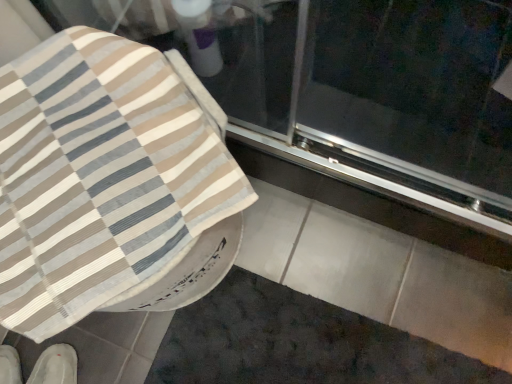
Question: In which direction should I rotate to look at transparent glass screen door at upper center?

Choices:
 (A) left
 (B) right

Answer: (B)

Question: Can white fabric slipper at lower left, which is the 1th footwear in right-to-left order, be found inside dark gray textured bath mat at lower center?

Choices:
 (A) yes
 (B) no

Answer: (B)

Question: Can you confirm if dark gray textured bath mat at lower center is taller than white fabric slipper at lower left, the 2th footwear from the left?

Choices:
 (A) no
 (B) yes

Answer: (A)

Question: Does dark gray textured bath mat at lower center have a larger size compared to white fabric slipper at lower left, which is the 1th footwear in right-to-left order?

Choices:
 (A) yes
 (B) no

Answer: (A)

Question: Considering the relative sizes of dark gray textured bath mat at lower center and white fabric slipper at lower left, the 2th footwear from the left, in the image provided, is dark gray textured bath mat at lower center thinner than white fabric slipper at lower left, the 2th footwear from the left,?

Choices:
 (A) no
 (B) yes

Answer: (A)

Question: Is dark gray textured bath mat at lower center positioned behind white fabric slipper at lower left, which is the 1th footwear in right-to-left order?

Choices:
 (A) yes
 (B) no

Answer: (A)

Question: Is dark gray textured bath mat at lower center turned away from white fabric slipper at lower left, the 2th footwear from the left?

Choices:
 (A) no
 (B) yes

Answer: (A)

Question: Does dark gray textured bath mat at lower center have a larger size compared to beige striped fabric at upper left?

Choices:
 (A) no
 (B) yes

Answer: (A)

Question: Is dark gray textured bath mat at lower center far away from beige striped fabric at upper left?

Choices:
 (A) no
 (B) yes

Answer: (A)

Question: Does dark gray textured bath mat at lower center appear on the right side of beige striped fabric at upper left?

Choices:
 (A) yes
 (B) no

Answer: (A)

Question: Does dark gray textured bath mat at lower center appear on the left side of beige striped fabric at upper left?

Choices:
 (A) yes
 (B) no

Answer: (B)

Question: From the image's perspective, is dark gray textured bath mat at lower center located above beige striped fabric at upper left?

Choices:
 (A) no
 (B) yes

Answer: (A)

Question: Does dark gray textured bath mat at lower center have a greater width compared to beige striped fabric at upper left?

Choices:
 (A) no
 (B) yes

Answer: (B)

Question: Is beige striped fabric at upper left not within white fabric shoe at lower left, which is the first footwear in left-to-right order?

Choices:
 (A) no
 (B) yes

Answer: (B)